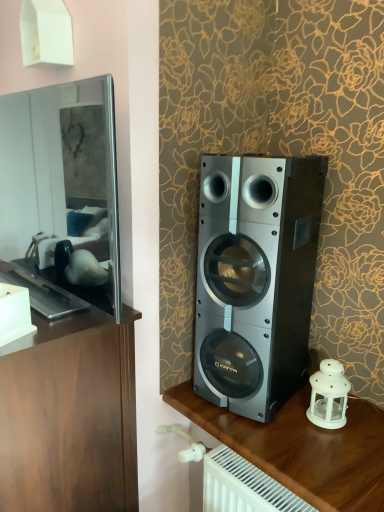
You are a GUI agent. You are given a task and a screenshot of the screen. Output one action in this format:
    pyautogui.click(x=<x>, y=<y>)
    Task: Click on the free location to the right of white matte lantern at lower right
    The image size is (384, 512).
    Given the screenshot: What is the action you would take?
    pyautogui.click(x=362, y=413)